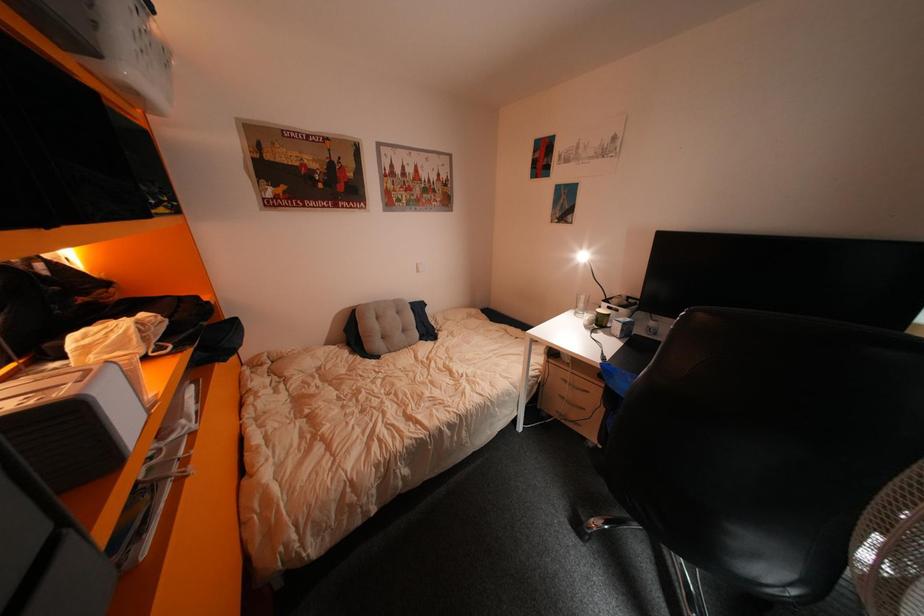
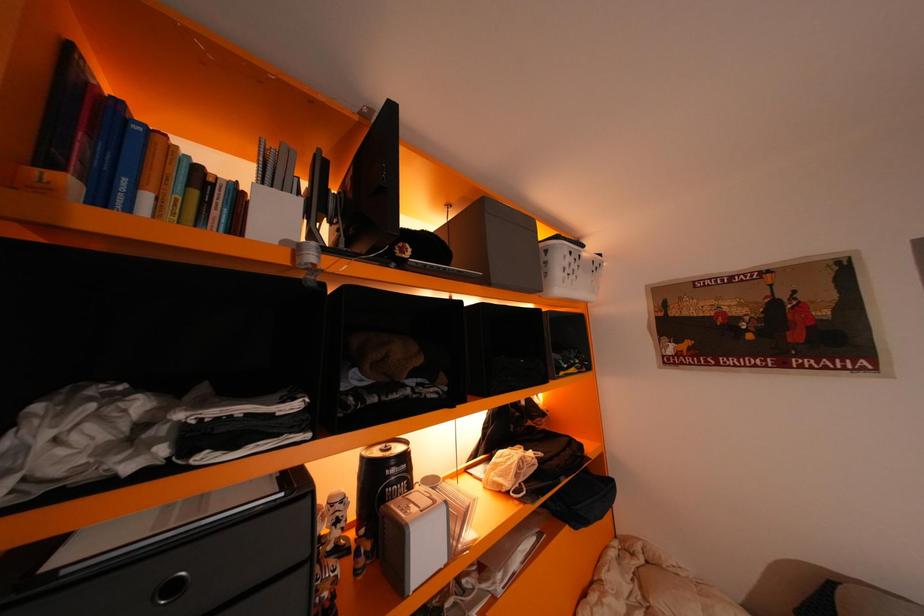
Question: The camera is either moving clockwise (left) or counter-clockwise (right) around the object. The first image is from the beginning of the video and the second image is from the end. Is the camera moving left or right when shooting the video?

Choices:
 (A) Left
 (B) Right

Answer: (B)